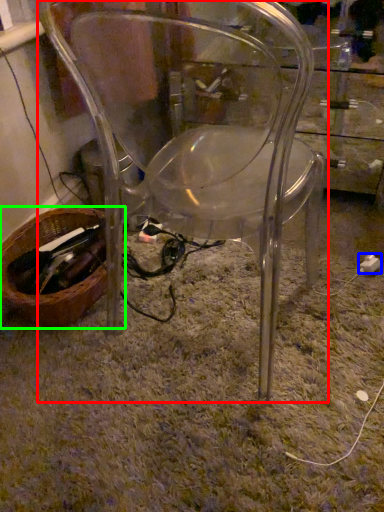
Question: Based on their relative distances, which object is farther from chair (highlighted by a red box)? Choose from plug (highlighted by a blue box) and basket (highlighted by a green box).

Choices:
 (A) plug
 (B) basket

Answer: (A)